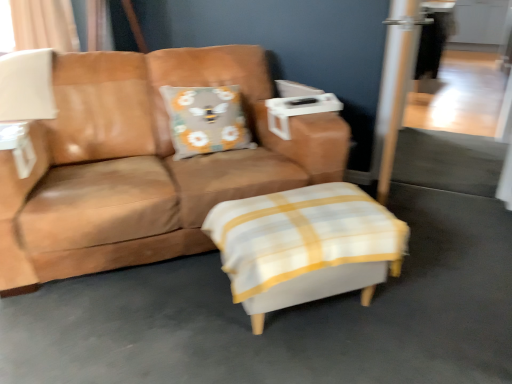
Where is `blank space above white fabric ottoman at center (from a real-world perspective)`? blank space above white fabric ottoman at center (from a real-world perspective) is located at coordinates (295, 216).